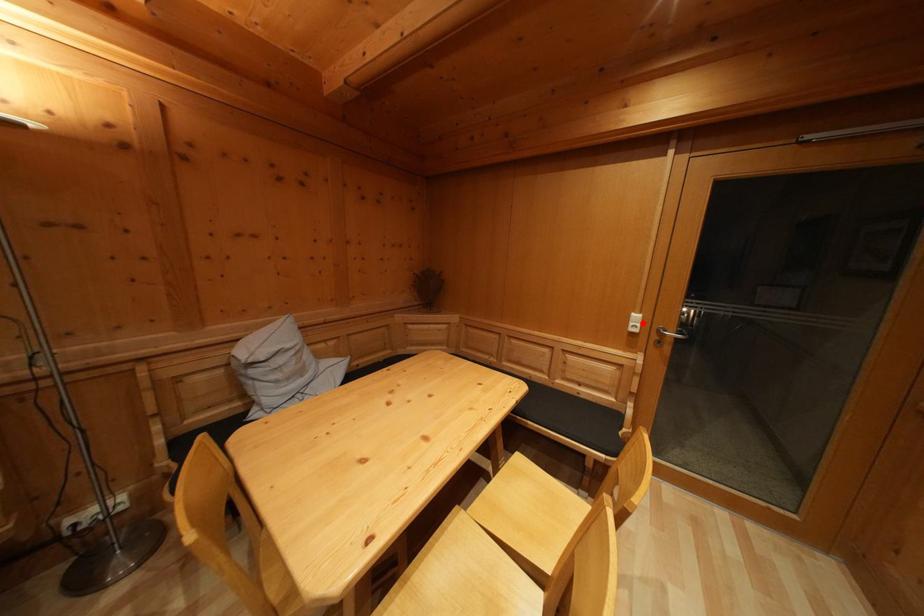
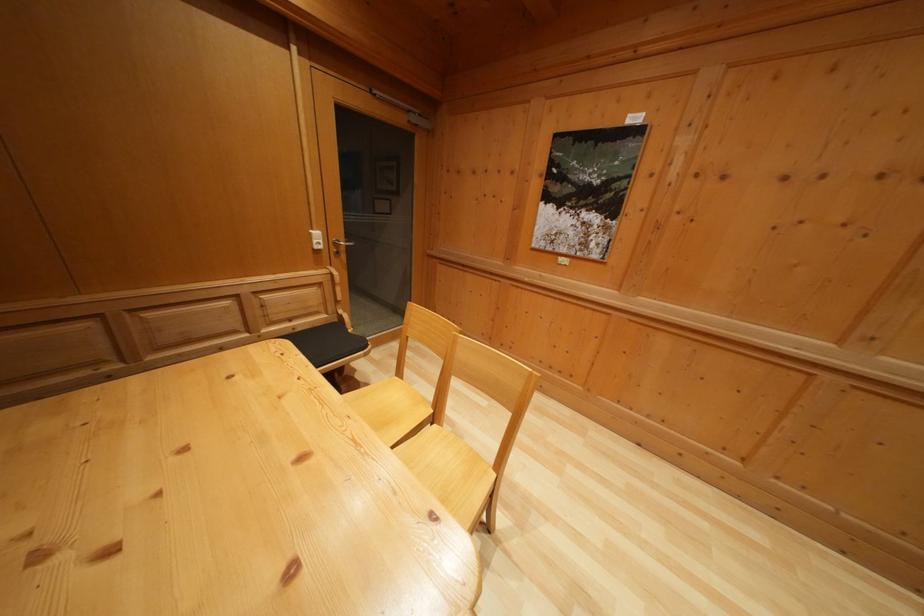
Question: I am providing you with two images of the same scene from different viewpoints. In image1, a red point is highlighted. Considering the same 3D point in image2, which of the following is correct?

Choices:
 (A) It is closer
 (B) It is farther

Answer: (A)